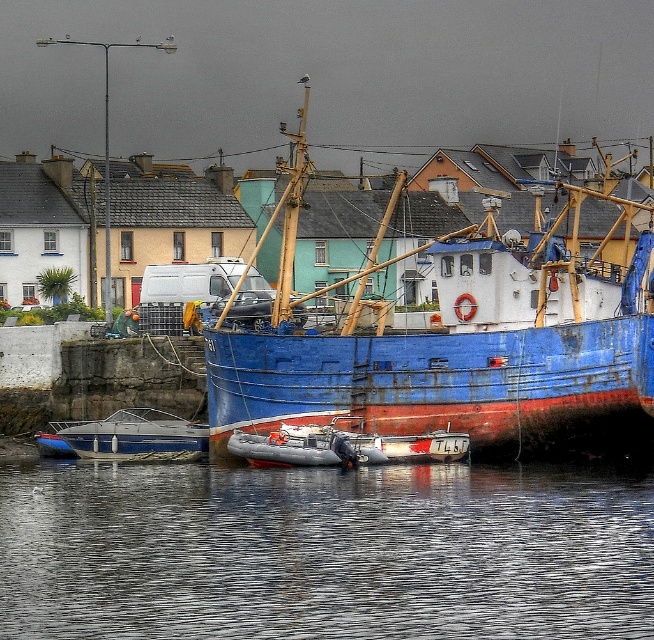
You are standing on the dock and looking at two points in the harbor scene. The first point is at coordinates point (405, 582) and the second is at point (613, 298). Which point is closer to you?

Point (405, 582) is closer to the viewer than point (613, 298).

You are standing at the edge of the harbor and see a point in the distance. The point is located at coordinates (94, 598). Based on the scene description, can you estimate how far this point is from you in feet?

The point at coordinates (94, 598) is 175.44 feet away from the viewer.